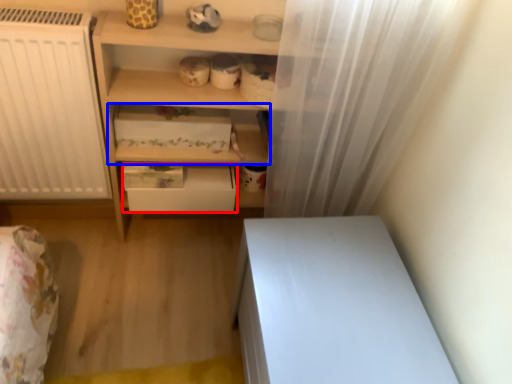
Question: Which point is further to the camera, drawer (highlighted by a red box) or shelf (highlighted by a blue box)?

Choices:
 (A) drawer
 (B) shelf

Answer: (A)